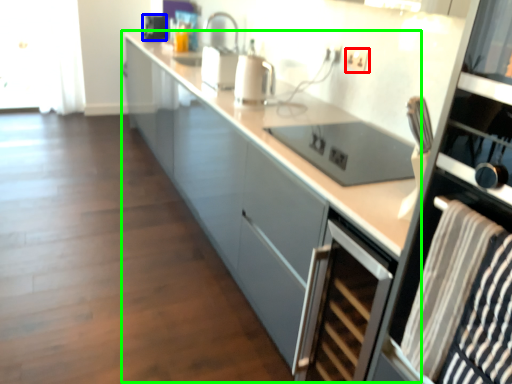
Question: Considering the real-world distances, which object is farthest from electric outlet (highlighted by a red box)? appliance (highlighted by a blue box) or cabinetry (highlighted by a green box)?

Choices:
 (A) appliance
 (B) cabinetry

Answer: (A)